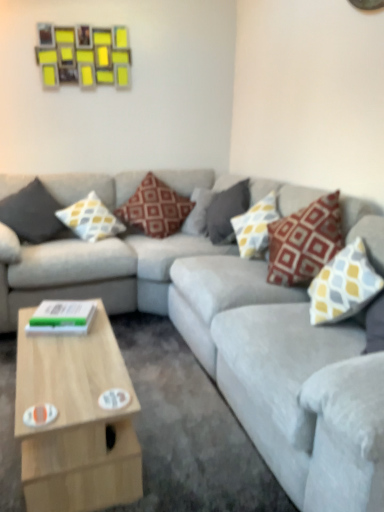
At what (x,y) coordinates should I click in order to perform the action: click on vacant space behind light wood coffee table at lower left. Please return your answer as a coordinate pair (x, y). Looking at the image, I should click on (147, 353).